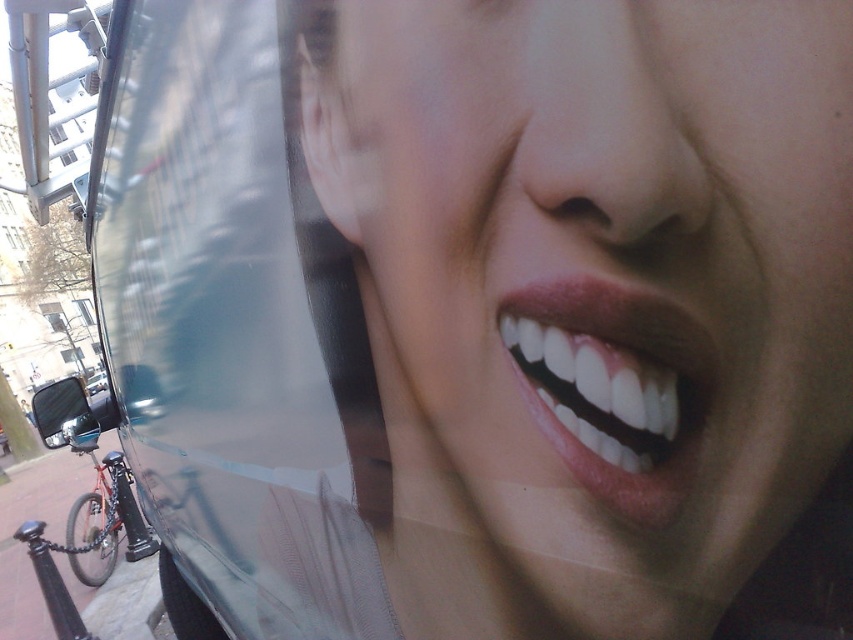
Can you confirm if transparent glass bus window at upper left is positioned below shiny metallic bicycle at lower left?

No, transparent glass bus window at upper left is not below shiny metallic bicycle at lower left.

From the picture: Can you confirm if transparent glass bus window at upper left is smaller than shiny metallic bicycle at lower left?

No, transparent glass bus window at upper left is not smaller than shiny metallic bicycle at lower left.

The height and width of the screenshot is (640, 853). I want to click on transparent glass bus window at upper left, so click(234, 332).

This screenshot has height=640, width=853. I want to click on transparent glass bus window at upper left, so [234, 332].

Does matte skin face at center appear under matte pink lips at center?

Incorrect, matte skin face at center is not positioned below matte pink lips at center.

Can you confirm if matte skin face at center is positioned to the right of matte pink lips at center?

Incorrect, matte skin face at center is not on the right side of matte pink lips at center.

Between point (381, 330) and point (630, 451), which one is positioned in front?

Point (630, 451)

This screenshot has width=853, height=640. Identify the location of matte skin face at center. (590, 310).

Between matte pink lips at center and shiny metallic bicycle at lower left, which one appears on the right side from the viewer's perspective?

matte pink lips at center is more to the right.

Is matte pink lips at center behind shiny metallic bicycle at lower left?

No, it is not.

Between point (634, 426) and point (78, 561), which one is positioned in front?

Point (634, 426) is more forward.

At what (x,y) coordinates should I click in order to perform the action: click on matte pink lips at center. Please return your answer as a coordinate pair (x, y). Looking at the image, I should click on (613, 385).